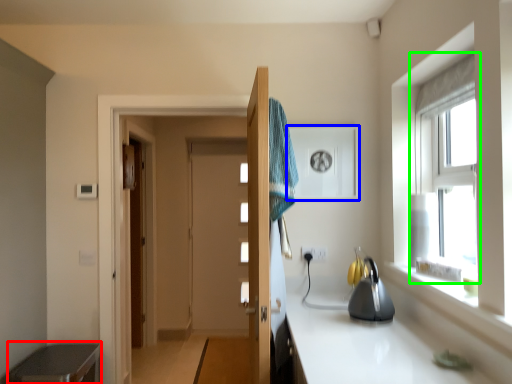
Question: Estimate the real-world distances between objects in this image. Which object is farther from cabinetry (highlighted by a red box), medicine cabinet (highlighted by a blue box) or window (highlighted by a green box)?

Choices:
 (A) medicine cabinet
 (B) window

Answer: (B)